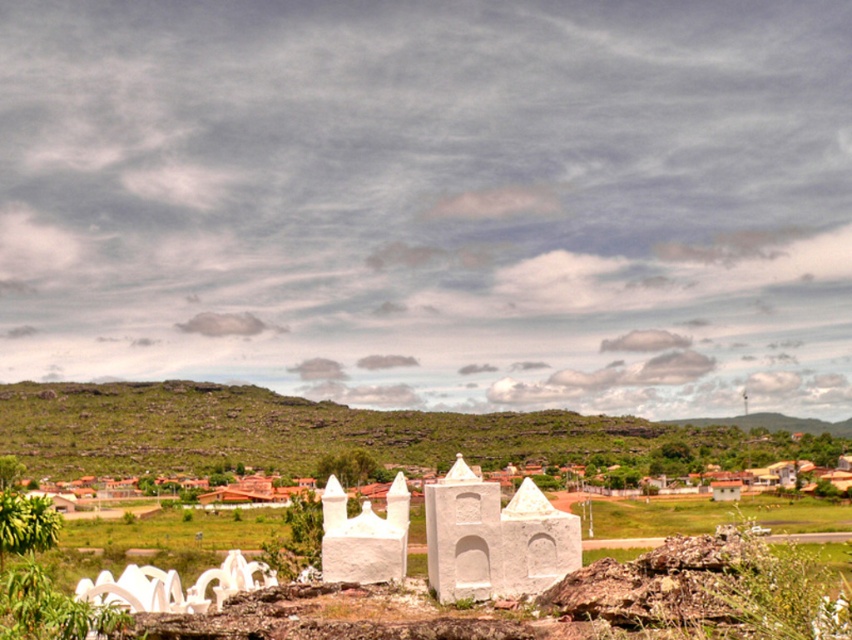
Question: Can you confirm if green grassy hillside at lower center is positioned to the left of white stone chapel at center?

Choices:
 (A) yes
 (B) no

Answer: (A)

Question: Does green grassy hillside at lower center have a greater width compared to white stone chapel at center?

Choices:
 (A) yes
 (B) no

Answer: (A)

Question: Is green grassy hillside at lower center thinner than white stone chapel at center?

Choices:
 (A) yes
 (B) no

Answer: (B)

Question: Which point is farther to the camera?

Choices:
 (A) (563, 564)
 (B) (429, 420)

Answer: (B)

Question: Which point is farther from the camera taking this photo?

Choices:
 (A) (513, 508)
 (B) (217, 451)

Answer: (B)

Question: Which point is closer to the camera?

Choices:
 (A) 479,596
 (B) 202,470

Answer: (A)